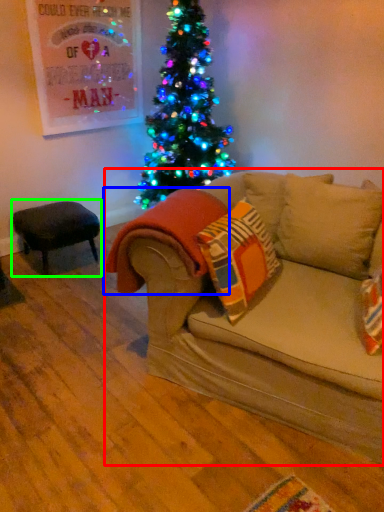
Question: Which is farther away from studio couch (highlighted by a red box)? blanket (highlighted by a blue box) or stool (highlighted by a green box)?

Choices:
 (A) blanket
 (B) stool

Answer: (B)